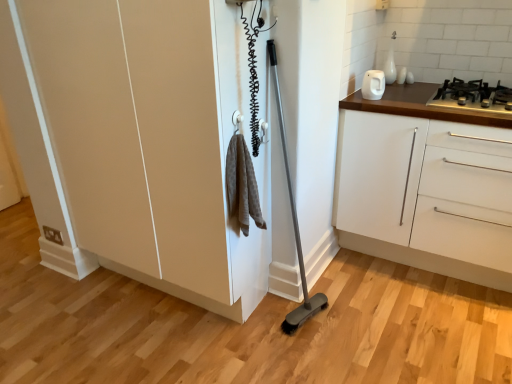
Question: Does white glossy kettle at upper right have a greater width compared to white glossy cabinet at right?

Choices:
 (A) no
 (B) yes

Answer: (A)

Question: Would you say white glossy kettle at upper right contains white glossy cabinet at right?

Choices:
 (A) yes
 (B) no

Answer: (B)

Question: Considering the relative sizes of white glossy kettle at upper right and white glossy cabinet at right in the image provided, is white glossy kettle at upper right thinner than white glossy cabinet at right?

Choices:
 (A) yes
 (B) no

Answer: (A)

Question: From the image's perspective, does white glossy kettle at upper right appear higher than white glossy cabinet at right?

Choices:
 (A) yes
 (B) no

Answer: (A)

Question: Is white glossy kettle at upper right facing away from white glossy cabinet at right?

Choices:
 (A) no
 (B) yes

Answer: (A)

Question: From the image's perspective, is white glossy cabinet at right above or below black metal gas stove at upper right?

Choices:
 (A) above
 (B) below

Answer: (B)

Question: In terms of height, does white glossy cabinet at right look taller or shorter compared to black metal gas stove at upper right?

Choices:
 (A) tall
 (B) short

Answer: (A)

Question: In terms of size, does white glossy cabinet at right appear bigger or smaller than black metal gas stove at upper right?

Choices:
 (A) small
 (B) big

Answer: (B)

Question: Is point pos(439,178) closer or farther from the camera than point pos(476,91)?

Choices:
 (A) farther
 (B) closer

Answer: (B)

Question: Is matte beige cupboard at center spatially inside white glossy kettle at upper right, or outside of it?

Choices:
 (A) outside
 (B) inside

Answer: (A)

Question: From the image's perspective, is matte beige cupboard at center located above or below white glossy kettle at upper right?

Choices:
 (A) above
 (B) below

Answer: (B)

Question: Considering their positions, is matte beige cupboard at center located in front of or behind white glossy kettle at upper right?

Choices:
 (A) front
 (B) behind

Answer: (A)

Question: From their relative heights in the image, would you say matte beige cupboard at center is taller or shorter than white glossy kettle at upper right?

Choices:
 (A) short
 (B) tall

Answer: (B)

Question: From the image's perspective, relative to black metal gas stove at upper right, is matte beige cupboard at center above or below?

Choices:
 (A) below
 (B) above

Answer: (A)

Question: In terms of size, does matte beige cupboard at center appear bigger or smaller than black metal gas stove at upper right?

Choices:
 (A) small
 (B) big

Answer: (B)